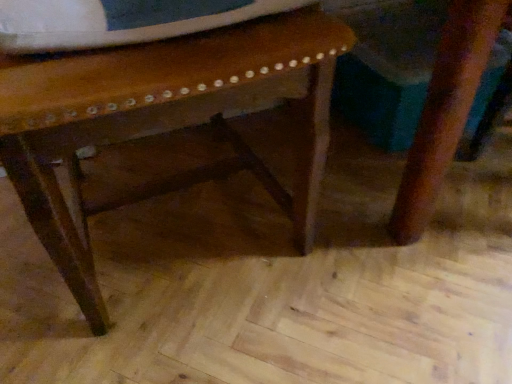
Locate an element on the screen. free point below wooden stool at center (from a real-world perspective) is located at coordinates (177, 208).